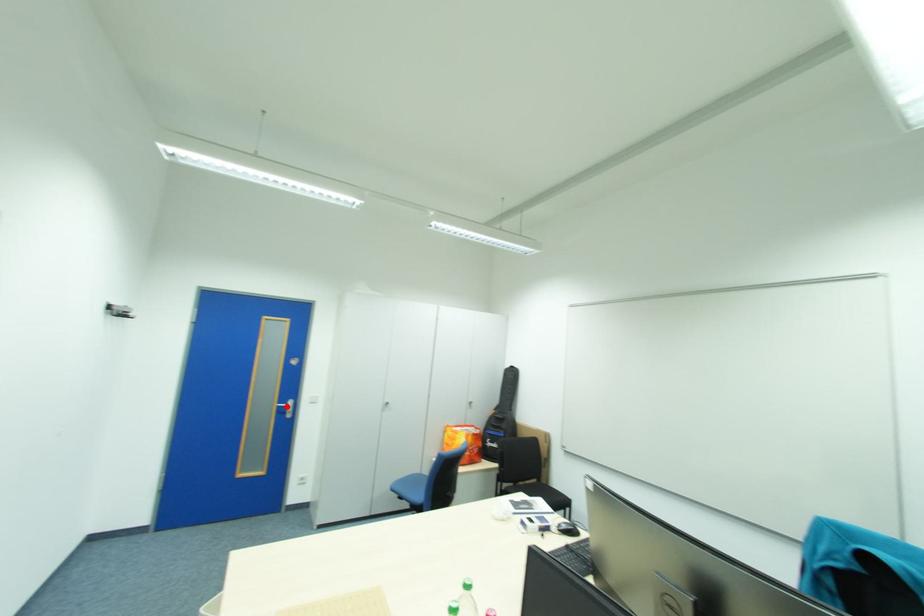
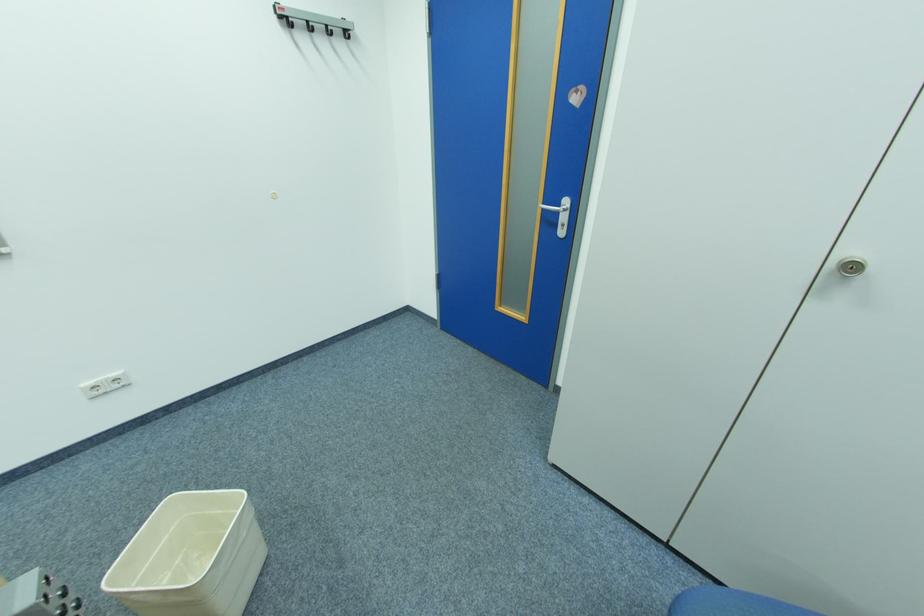
Locate, in the second image, the point that corresponds to the highlighted location in the first image.

(552, 209)